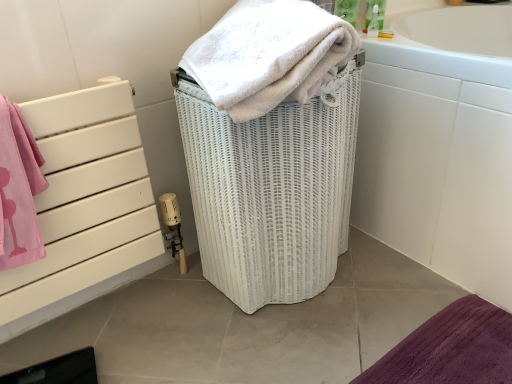
Question: Choose the correct answer: Is white soft towel at center inside white wicker basket at center or outside it?

Choices:
 (A) outside
 (B) inside

Answer: (A)

Question: Is white soft towel at center taller or shorter than white wicker basket at center?

Choices:
 (A) tall
 (B) short

Answer: (B)

Question: Which object is positioned farthest from the white soft towel at center?

Choices:
 (A) white glossy bathtub at right
 (B) white wicker basket at center

Answer: (A)

Question: Estimate the real-world distances between objects in this image. Which object is farther from the white glossy bathtub at right?

Choices:
 (A) white soft towel at center
 (B) white wicker basket at center

Answer: (A)